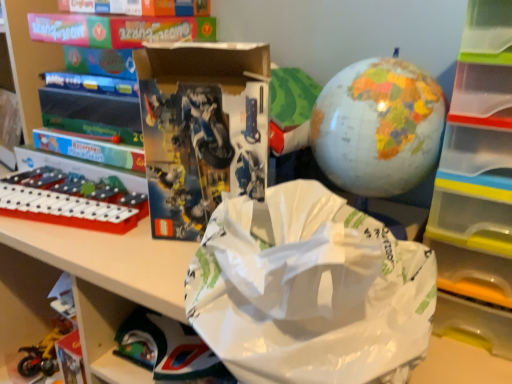
This screenshot has height=384, width=512. Identify the location of vacant position to the left of matte black lego set at center. (100, 243).